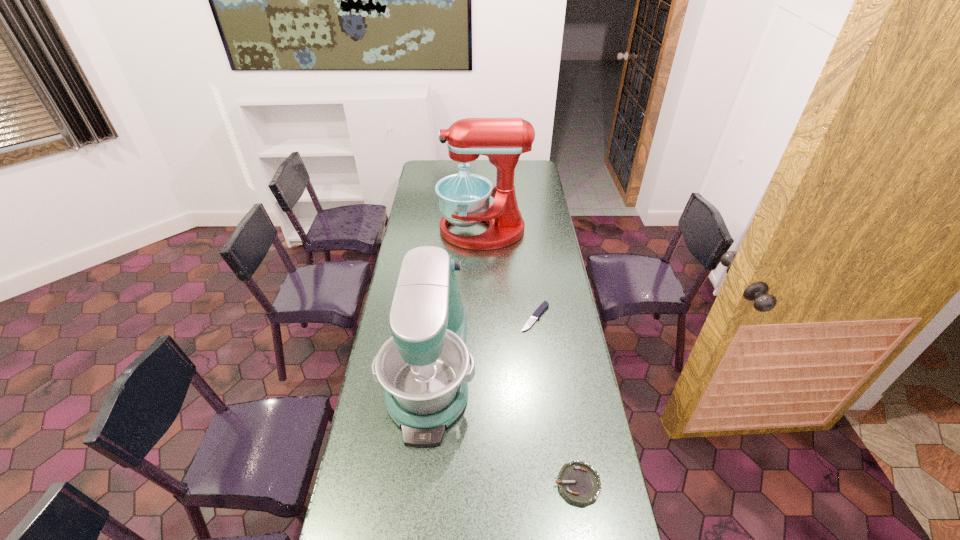
Identify the location of free space in the image that satisfies the following two spatial constraints: 1. on the back side of the shortest object; 2. on the front-facing side of the taller mixer. The width and height of the screenshot is (960, 540). (x=524, y=230).

Find the location of a particular element. This screenshot has width=960, height=540. vacant point that satisfies the following two spatial constraints: 1. on the front-facing side of the third tallest object; 2. on the right side of the second tallest object is located at coordinates (419, 484).

Locate an element on the screen. The width and height of the screenshot is (960, 540). vacant space that satisfies the following two spatial constraints: 1. on the front-facing side of the tallest object; 2. on the back side of the steak knife is located at coordinates (483, 318).

The height and width of the screenshot is (540, 960). I want to click on vacant area that satisfies the following two spatial constraints: 1. on the front-facing side of the farther mixer; 2. on the back side of the steak knife, so click(483, 318).

You are a GUI agent. You are given a task and a screenshot of the screen. Output one action in this format:
    pyautogui.click(x=<x>, y=<y>)
    Task: Click on the vacant space that satisfies the following two spatial constraints: 1. on the front-facing side of the tallest object; 2. on the back side of the ashtray
    Image resolution: width=960 pixels, height=540 pixels.
    Given the screenshot: What is the action you would take?
    pyautogui.click(x=485, y=484)

Where is `vacant space that satisfies the following two spatial constraints: 1. on the front-facing side of the tallest object; 2. on the left side of the steak knife`? This screenshot has width=960, height=540. vacant space that satisfies the following two spatial constraints: 1. on the front-facing side of the tallest object; 2. on the left side of the steak knife is located at coordinates (483, 318).

What are the coordinates of `vacant point that satisfies the following two spatial constraints: 1. on the front-facing side of the tallest object; 2. on the back side of the shortest object` in the screenshot? It's located at (483, 318).

The width and height of the screenshot is (960, 540). Identify the location of vacant space that satisfies the following two spatial constraints: 1. on the front-facing side of the steak knife; 2. on the right side of the tallest object. (483, 318).

You are a GUI agent. You are given a task and a screenshot of the screen. Output one action in this format:
    pyautogui.click(x=<x>, y=<y>)
    Task: Click on the free spot that satisfies the following two spatial constraints: 1. on the front-facing side of the tallest object; 2. on the left side of the steak knife
    
    Given the screenshot: What is the action you would take?
    pyautogui.click(x=483, y=318)